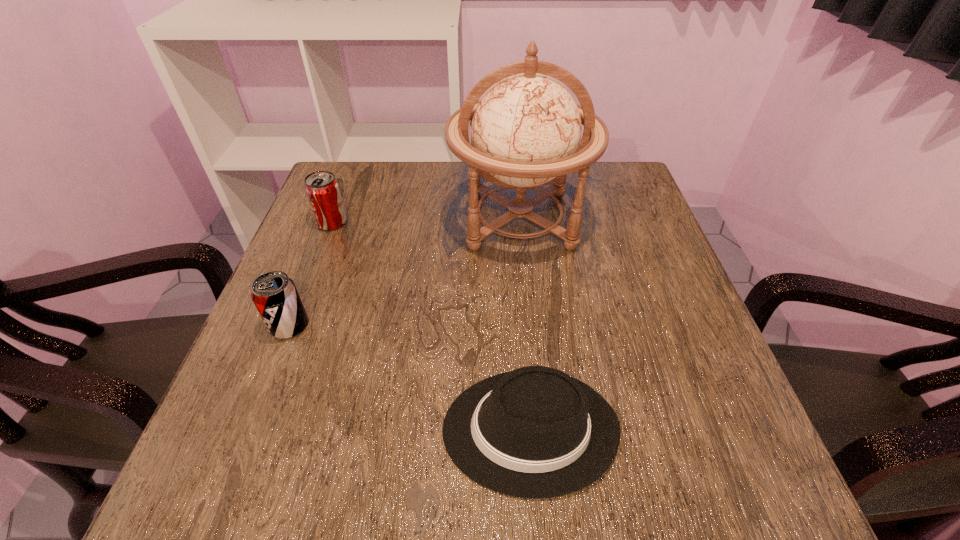
At what (x,y) coordinates should I click in order to perform the action: click on vacant region between the shortest object and the tallest object. Please return your answer as a coordinate pair (x, y). This screenshot has width=960, height=540. Looking at the image, I should click on (524, 325).

At what (x,y) coordinates should I click in order to perform the action: click on object that can be found as the closest to the nearest object. Please return your answer as a coordinate pair (x, y). This screenshot has height=540, width=960. Looking at the image, I should click on 525,131.

Where is `object that can be found as the second closest to the farther soda can`? This screenshot has height=540, width=960. object that can be found as the second closest to the farther soda can is located at coordinates (525, 131).

Image resolution: width=960 pixels, height=540 pixels. What are the coordinates of `free location that satisfies the following two spatial constraints: 1. on the front-facing side of the globe; 2. on the front-facing side of the nearest object` in the screenshot? It's located at pyautogui.click(x=540, y=429).

This screenshot has height=540, width=960. Find the location of `free space that satisfies the following two spatial constraints: 1. on the front-facing side of the tallest object; 2. on the front-facing side of the fedora`. free space that satisfies the following two spatial constraints: 1. on the front-facing side of the tallest object; 2. on the front-facing side of the fedora is located at coordinates (540, 429).

Locate an element on the screen. The height and width of the screenshot is (540, 960). free space that satisfies the following two spatial constraints: 1. on the front-facing side of the tallest object; 2. on the front-facing side of the shortest object is located at coordinates (540, 429).